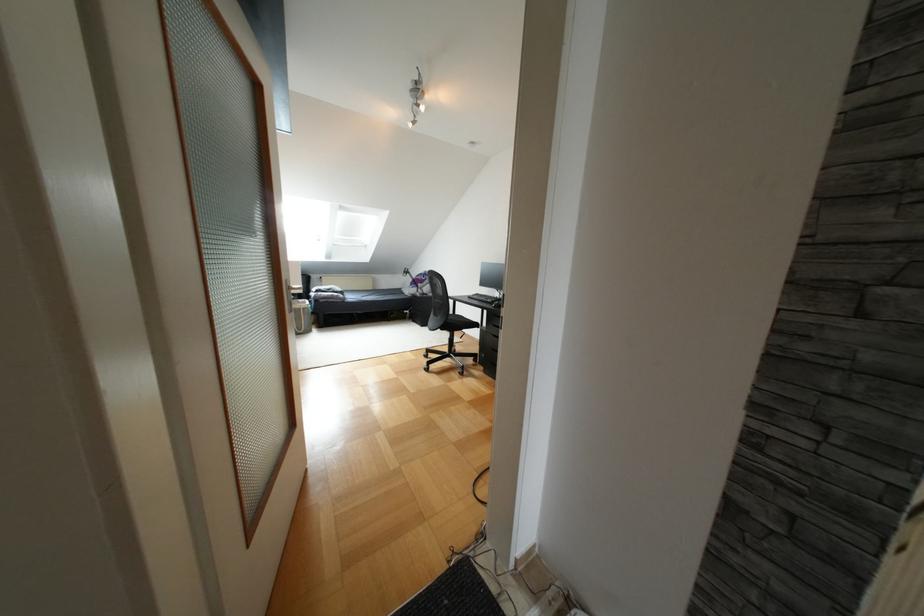
The image size is (924, 616). Find the location of `sofa sitting surface`. sofa sitting surface is located at coordinates (373, 294).